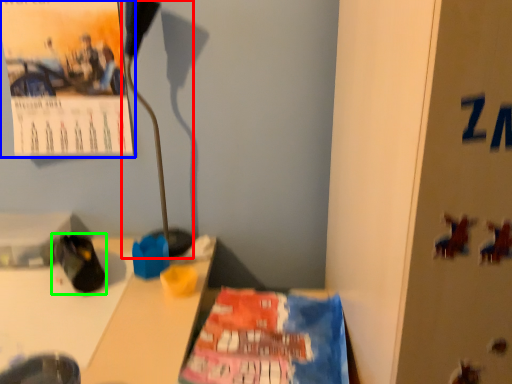
Question: Based on their relative distances, which object is nearer to lamp (highlighted by a red box)? Choose from poster (highlighted by a blue box) and footwear (highlighted by a green box).

Choices:
 (A) poster
 (B) footwear

Answer: (A)